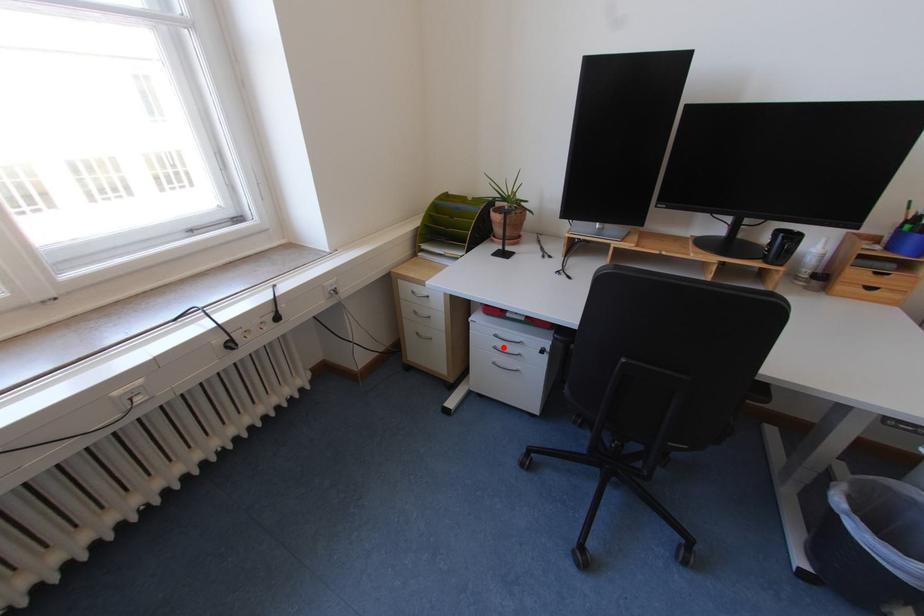
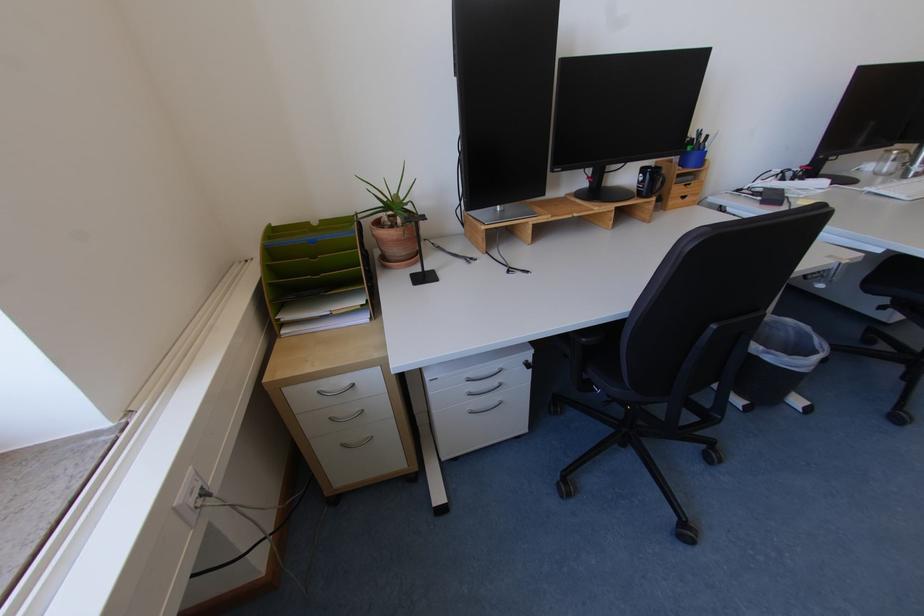
Find the pixel in the second image that matches the highlighted location in the first image.

(477, 392)